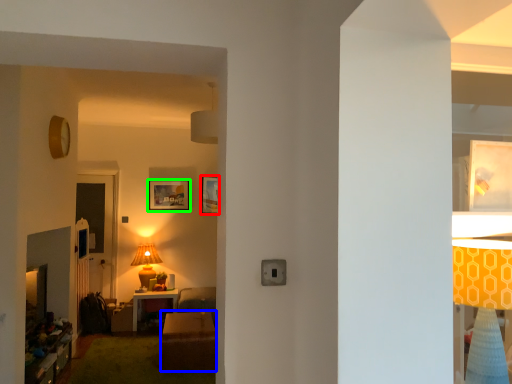
Question: Which object is positioned closest to picture frame (highlighted by a red box)? Select from table (highlighted by a blue box) and picture frame (highlighted by a green box).

Choices:
 (A) table
 (B) picture frame

Answer: (B)